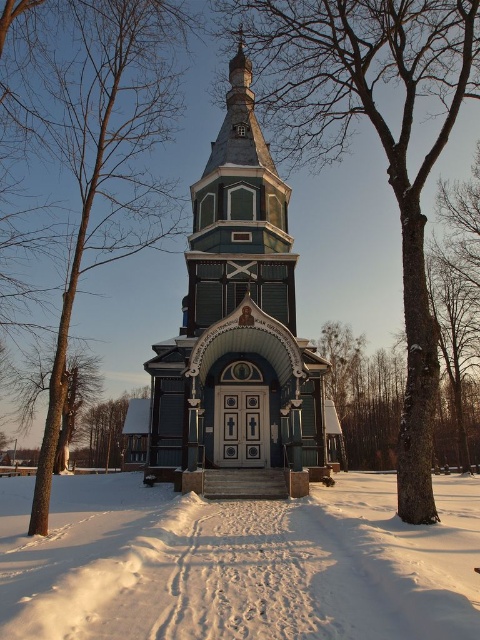
Is white fluffy snow at center wider than green wood tree at center?

Indeed, white fluffy snow at center has a greater width compared to green wood tree at center.

Between white fluffy snow at center and green wood tree at center, which one has less height?

white fluffy snow at center

Locate an element on the screen. The height and width of the screenshot is (640, 480). white fluffy snow at center is located at coordinates click(238, 563).

Who is positioned more to the right, brown wood tree at center or green wood tree at lower left?

From the viewer's perspective, brown wood tree at center appears more on the right side.

Is brown wood tree at center bigger than green wood tree at lower left?

Indeed, brown wood tree at center has a larger size compared to green wood tree at lower left.

The height and width of the screenshot is (640, 480). I want to click on brown wood tree at center, so click(110, 160).

Does dark green wood church at center have a greater width compared to green wood tree at center?

No, dark green wood church at center is not wider than green wood tree at center.

Does dark green wood church at center have a lesser height compared to green wood tree at center?

Yes.

At what (x,y) coordinates should I click in order to perform the action: click on dark green wood church at center. Please return your answer as a coordinate pair (x, y). The height and width of the screenshot is (640, 480). Looking at the image, I should click on (239, 333).